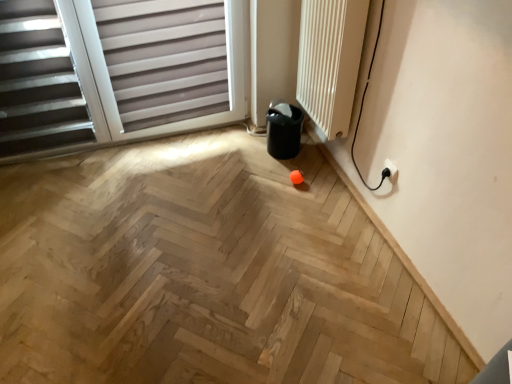
Find the location of a particular element. free space in front of matte gray blinds at upper left is located at coordinates (111, 221).